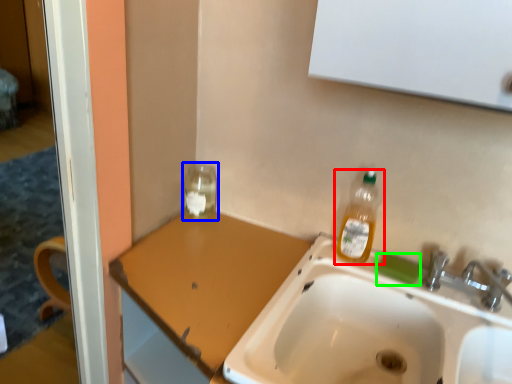
Question: Based on their relative distances, which object is nearer to bottle (highlighted by a red box)? Choose from glass jar (highlighted by a blue box) and soap (highlighted by a green box).

Choices:
 (A) glass jar
 (B) soap

Answer: (B)